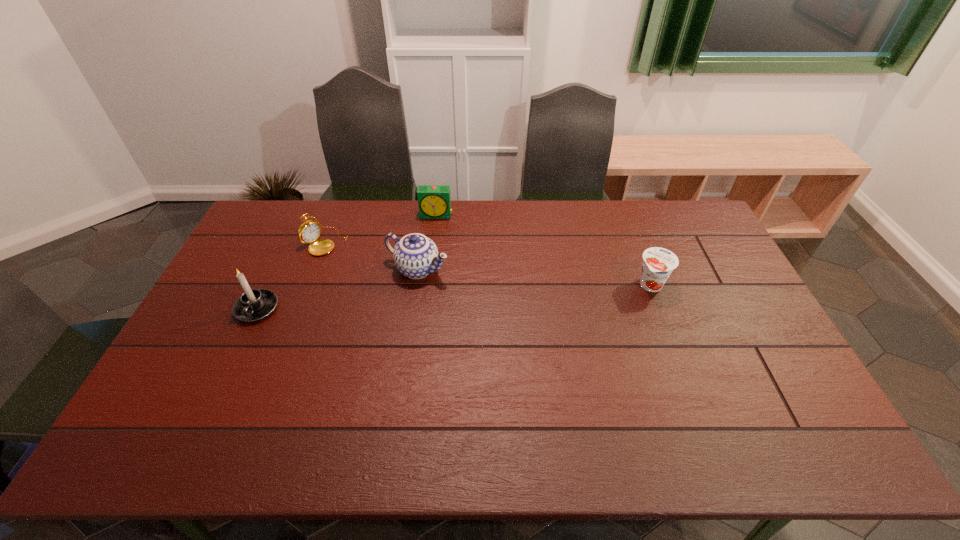
Where is `free space between the pocket watch and the alarm clock`? free space between the pocket watch and the alarm clock is located at coordinates (381, 228).

Identify the location of free space between the rightmost object and the tallest object. The height and width of the screenshot is (540, 960). (454, 297).

Identify the location of free space between the pocket watch and the chinaware. This screenshot has width=960, height=540. (372, 255).

Find the location of `vacant space that's between the candle holder and the pocket watch`. vacant space that's between the candle holder and the pocket watch is located at coordinates (291, 275).

Locate which object ranks second in proximity to the chinaware. Please provide its 2D coordinates. Your answer should be formatted as a tuple, i.e. [(x, y)], where the tuple contains the x and y coordinates of a point satisfying the conditions above.

[(434, 201)]

Locate which object ranks third in proximity to the chinaware. Please provide its 2D coordinates. Your answer should be formatted as a tuple, i.e. [(x, y)], where the tuple contains the x and y coordinates of a point satisfying the conditions above.

[(254, 304)]

Locate an element on the screen. vacant region that satisfies the following two spatial constraints: 1. on the back side of the farthest object; 2. on the right side of the pocket watch is located at coordinates (336, 215).

In order to click on free location that satisfies the following two spatial constraints: 1. on the front side of the chinaware; 2. on the left side of the rightmost object in this screenshot , I will do `click(416, 285)`.